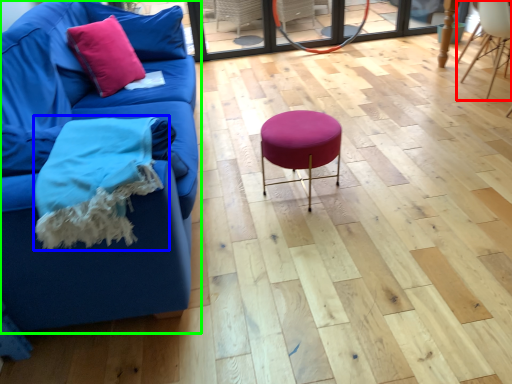
Question: Based on their relative distances, which object is nearer to chair (highlighted by a red box)? Choose from blanket (highlighted by a blue box) and studio couch (highlighted by a green box).

Choices:
 (A) blanket
 (B) studio couch

Answer: (B)